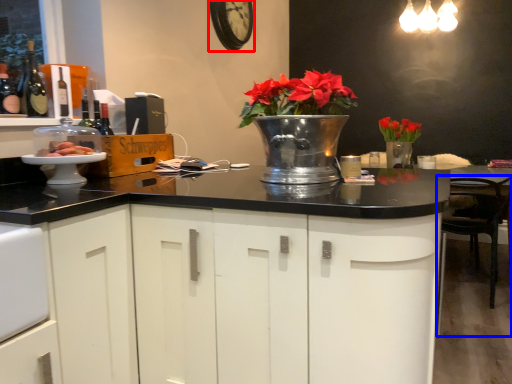
Question: Which object appears closest to the camera in this image, clock (highlighted by a red box) or chair (highlighted by a blue box)?

Choices:
 (A) clock
 (B) chair

Answer: (B)